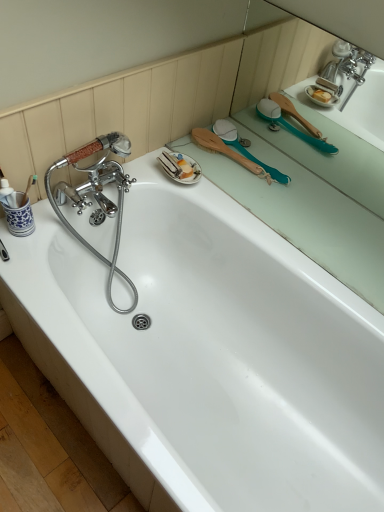
Question: Is white glossy bathtub at upper center located outside green rubber brush at upper right, the 1th mirror from the top?

Choices:
 (A) no
 (B) yes

Answer: (B)

Question: Considering the relative sizes of white glossy bathtub at upper center and green rubber brush at upper right, the 1th mirror from the top, in the image provided, is white glossy bathtub at upper center thinner than green rubber brush at upper right, the 1th mirror from the top,?

Choices:
 (A) no
 (B) yes

Answer: (A)

Question: Does white glossy bathtub at upper center have a larger size compared to green rubber brush at upper right, the 1th mirror from the top?

Choices:
 (A) yes
 (B) no

Answer: (A)

Question: Does white glossy bathtub at upper center have a greater height compared to green rubber brush at upper right, the 2th mirror from the bottom?

Choices:
 (A) no
 (B) yes

Answer: (B)

Question: Is the position of white glossy bathtub at upper center less distant than that of green rubber brush at upper right, the 2th mirror from the bottom?

Choices:
 (A) yes
 (B) no

Answer: (A)

Question: Considering the relative sizes of white glossy bathtub at upper center and green rubber brush at upper right, the 1th mirror from the top, in the image provided, is white glossy bathtub at upper center shorter than green rubber brush at upper right, the 1th mirror from the top,?

Choices:
 (A) no
 (B) yes

Answer: (A)

Question: Does teal rubber brush at upper right, the second mirror in the top-to-bottom sequence, come behind green rubber brush at upper right, the 1th mirror from the top?

Choices:
 (A) no
 (B) yes

Answer: (B)

Question: From a real-world perspective, does teal rubber brush at upper right, the second mirror in the top-to-bottom sequence, sit lower than green rubber brush at upper right, the 1th mirror from the top?

Choices:
 (A) no
 (B) yes

Answer: (B)

Question: From a real-world perspective, is teal rubber brush at upper right, the first mirror ordered from the bottom, on top of green rubber brush at upper right, the 2th mirror from the bottom?

Choices:
 (A) no
 (B) yes

Answer: (A)

Question: Can you confirm if teal rubber brush at upper right, the first mirror ordered from the bottom, is wider than green rubber brush at upper right, the 2th mirror from the bottom?

Choices:
 (A) no
 (B) yes

Answer: (B)

Question: Is teal rubber brush at upper right, the second mirror in the top-to-bottom sequence, at the left side of green rubber brush at upper right, the 1th mirror from the top?

Choices:
 (A) yes
 (B) no

Answer: (A)

Question: Is teal rubber brush at upper right, the first mirror ordered from the bottom, looking in the opposite direction of green rubber brush at upper right, the 2th mirror from the bottom?

Choices:
 (A) no
 (B) yes

Answer: (B)

Question: Is green rubber brush at upper right, the 2th mirror from the bottom, not near teal rubber brush at upper right, the second mirror in the top-to-bottom sequence?

Choices:
 (A) no
 (B) yes

Answer: (A)